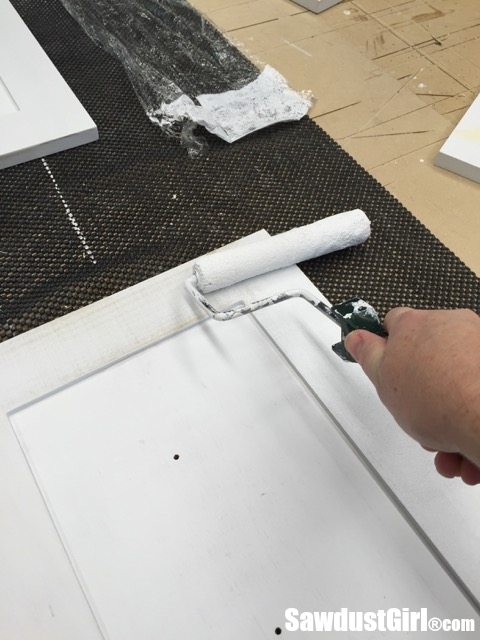
Find the location of a particular element. The image size is (480, 640). tan tile floor is located at coordinates (420, 56).